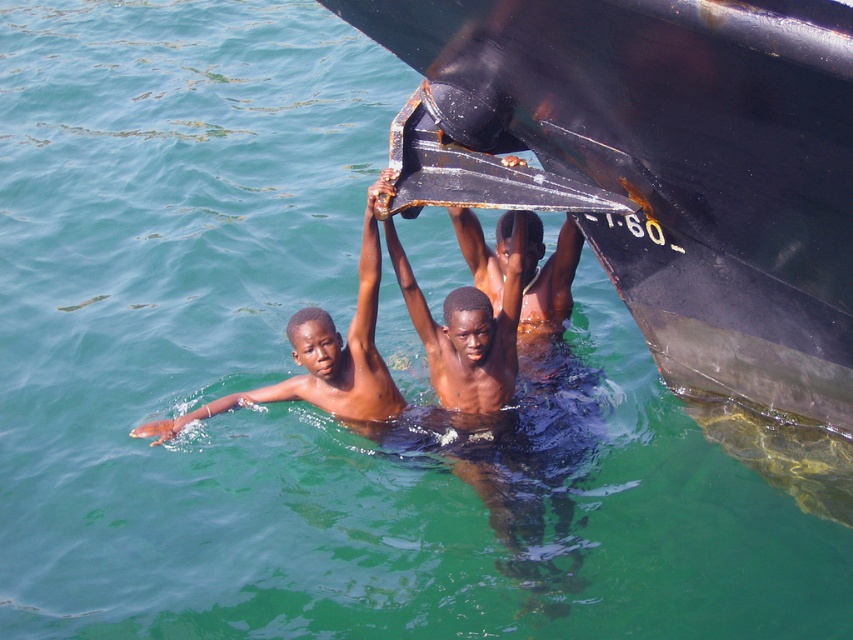
You are a lifeguard observing the scene. There is a rusty metal boat at upper center and a smooth skin child at left. Which object is closer to you?

The rusty metal boat at upper center is closer to you because it is in front of the smooth skin child at left.

You are a lifeguard observing the scene. There are two objects in the water, the rusty metal boat at upper center and the smooth dark wood plank at center. Which object is higher above the water surface?

The rusty metal boat at upper center is taller than smooth dark wood plank at center, so the rusty metal boat at upper center is higher above the water surface.